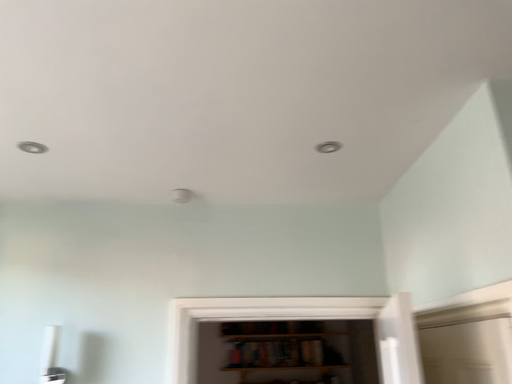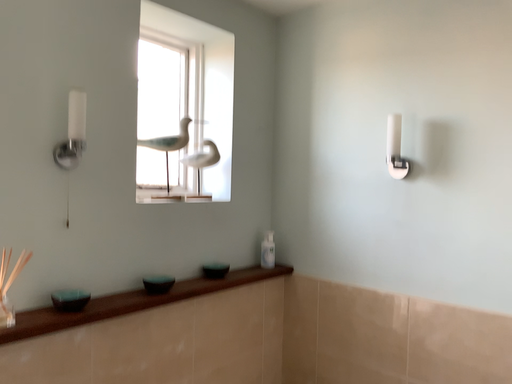
Question: How did the camera likely rotate when shooting the video?

Choices:
 (A) rotated left
 (B) rotated right

Answer: (A)